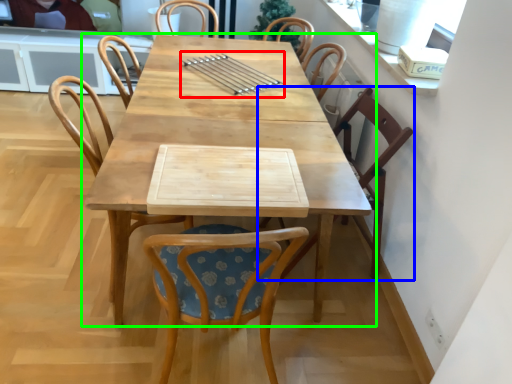
Question: Which object is the farthest from tableware (highlighted by a red box)? Choose among these: chair (highlighted by a blue box) or table (highlighted by a green box).

Choices:
 (A) chair
 (B) table

Answer: (A)